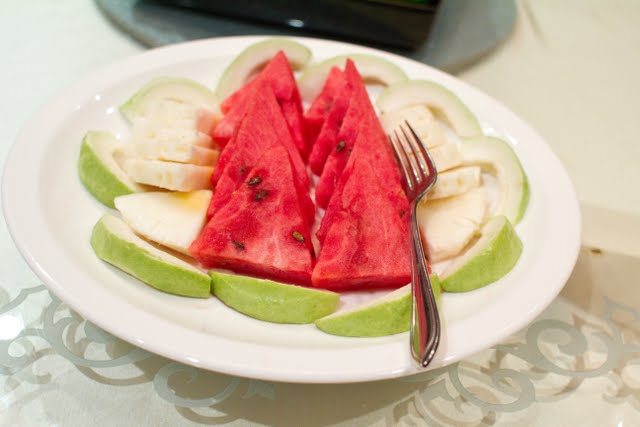
Image resolution: width=640 pixels, height=427 pixels. I want to click on table, so click(554, 392).